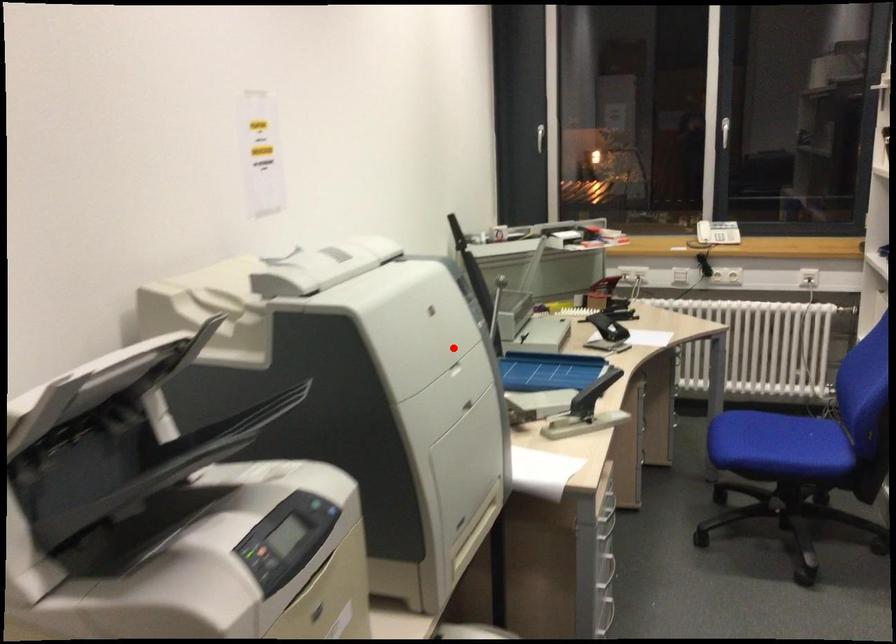
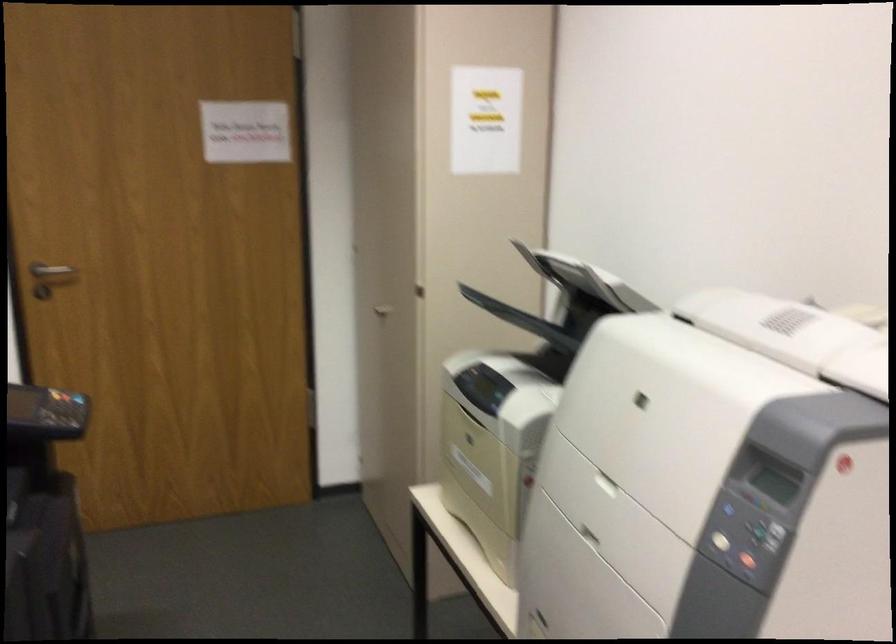
Question: I am providing you with two images of the same scene from different viewpoints. Given a red point in image1, look at the same physical point in image2. Is it:

Choices:
 (A) Closer to the viewpoint
 (B) Farther from the viewpoint

Answer: (A)